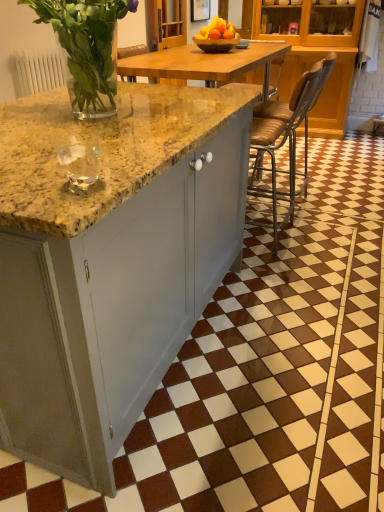
Find the location of a particular element. The width and height of the screenshot is (384, 512). clear glass vase at upper left is located at coordinates (87, 48).

At what (x,y) coordinates should I click in order to perform the action: click on matte gray cabinet at center. Please return your answer as a coordinate pair (x, y). The image size is (384, 512). Looking at the image, I should click on (109, 264).

This screenshot has width=384, height=512. Find the location of `metallic brown bar stool at center`. metallic brown bar stool at center is located at coordinates (286, 133).

The width and height of the screenshot is (384, 512). Describe the element at coordinates (79, 161) in the screenshot. I see `clear glass at left` at that location.

Looking at this image, what is the approximate height of wooden bowl at center?

2.49 inches.

Find the location of `clear glass vase at upper left`. clear glass vase at upper left is located at coordinates (87, 48).

From a real-world perspective, who is located higher, matte gray cabinet at center or wooden bowl at center?

wooden bowl at center, from a real-world perspective.

Would you say matte gray cabinet at center is inside or outside wooden bowl at center?

matte gray cabinet at center is spatially situated outside wooden bowl at center.

Does matte gray cabinet at center come behind wooden bowl at center?

No, the depth of matte gray cabinet at center is less than that of wooden bowl at center.

Can you confirm if matte gray cabinet at center is wider than wooden bowl at center?

Yes, matte gray cabinet at center is wider than wooden bowl at center.

Does wooden bowl at center touch clear glass vase at upper left?

There is a gap between wooden bowl at center and clear glass vase at upper left.

Considering the sizes of objects wooden bowl at center and clear glass vase at upper left in the image provided, who is thinner, wooden bowl at center or clear glass vase at upper left?

wooden bowl at center is thinner.

Can we say wooden bowl at center lies outside clear glass vase at upper left?

wooden bowl at center lies outside clear glass vase at upper left's area.

Between wooden bowl at center and clear glass vase at upper left, which one has smaller size?

wooden bowl at center.

Is clear glass vase at upper left thinner than wooden bowl at center?

No, clear glass vase at upper left is not thinner than wooden bowl at center.

From a real-world perspective, is clear glass vase at upper left physically located above or below wooden bowl at center?

Clearly, from a real-world perspective, clear glass vase at upper left is above wooden bowl at center.

Consider the image. Is clear glass vase at upper left positioned beyond the bounds of wooden bowl at center?

clear glass vase at upper left is positioned outside wooden bowl at center.

Which is closer to the camera, (111, 27) or (205, 42)?

Point (111, 27).

Is matte gray cabinet at center beside clear glass at left?

No.

Is matte gray cabinet at center positioned behind clear glass at left?

Yes, matte gray cabinet at center is further from the viewer.

Based on the photo, considering the relative sizes of matte gray cabinet at center and clear glass at left in the image provided, is matte gray cabinet at center shorter than clear glass at left?

Yes.

Can you confirm if clear glass at left is taller than metallic brown bar stool at center?

In fact, clear glass at left may be shorter than metallic brown bar stool at center.

From the image's perspective, is clear glass at left located above metallic brown bar stool at center?

No, from the image's perspective, clear glass at left is not above metallic brown bar stool at center.

Locate an element on the screen. The image size is (384, 512). wine glass in front of the metallic brown bar stool at center is located at coordinates (79, 161).

Which of these two, clear glass at left or metallic brown bar stool at center, is thinner?

Thinner between the two is clear glass at left.

From the image's perspective, is wooden bowl at center beneath clear glass at left?

Incorrect, from the image's perspective, wooden bowl at center is higher than clear glass at left.

Is the depth of wooden bowl at center less than that of clear glass at left?

No.

Which object is wider, wooden bowl at center or clear glass at left?

wooden bowl at center is wider.

From a real-world perspective, between wooden bowl at center and clear glass at left, who is vertically higher?

wooden bowl at center is physically above.

Considering the positions of objects clear glass vase at upper left and matte gray cabinet at center in the image provided, who is more to the right, clear glass vase at upper left or matte gray cabinet at center?

Positioned to the right is matte gray cabinet at center.

Can you tell me how much clear glass vase at upper left and matte gray cabinet at center differ in facing direction?

87.7 degrees.

Considering the positions of objects clear glass vase at upper left and matte gray cabinet at center in the image provided, who is behind, clear glass vase at upper left or matte gray cabinet at center?

clear glass vase at upper left is further away from the camera.

Measure the distance between clear glass vase at upper left and matte gray cabinet at center.

20.51 inches.

At what (x,y) coordinates should I click in order to perform the action: click on bowl behind the matte gray cabinet at center. Please return your answer as a coordinate pair (x, y). The image size is (384, 512). Looking at the image, I should click on (216, 44).

Where is `bowl to the right of clear glass vase at upper left`? bowl to the right of clear glass vase at upper left is located at coordinates click(216, 44).

Estimate the real-world distances between objects in this image. Which object is closer to matte gray cabinet at center, clear glass at left or wooden bowl at center?

The object closer to matte gray cabinet at center is clear glass at left.

Estimate the real-world distances between objects in this image. Which object is closer to clear glass vase at upper left, wooden bowl at center or clear glass at left?

Based on the image, clear glass at left appears to be nearer to clear glass vase at upper left.

Which object lies further to the anchor point matte gray cabinet at center, clear glass at left or metallic brown bar stool at center?

metallic brown bar stool at center lies further to matte gray cabinet at center than the other object.

Estimate the real-world distances between objects in this image. Which object is further from clear glass at left, matte gray cabinet at center or metallic brown bar stool at center?

The object further to clear glass at left is metallic brown bar stool at center.

Looking at this image, when comparing their distances from metallic brown bar stool at center, does matte gray cabinet at center or clear glass at left seem further?

Based on the image, clear glass at left appears to be further to metallic brown bar stool at center.

Considering their positions, is matte gray cabinet at center positioned further to clear glass at left than wooden bowl at center?

Based on the image, wooden bowl at center appears to be further to clear glass at left.

From the image, which object appears to be nearer to clear glass at left, metallic brown bar stool at center or clear glass vase at upper left?

clear glass vase at upper left lies closer to clear glass at left than the other object.

Considering their positions, is matte gray cabinet at center positioned further to metallic brown bar stool at center than wooden bowl at center?

matte gray cabinet at center is further to metallic brown bar stool at center.

Where is `floral arrangement between matte gray cabinet at center and metallic brown bar stool at center along the z-axis`? The width and height of the screenshot is (384, 512). floral arrangement between matte gray cabinet at center and metallic brown bar stool at center along the z-axis is located at coordinates (87, 48).

Identify the location of chair positioned between clear glass vase at upper left and wooden bowl at center from near to far. This screenshot has height=512, width=384. (286, 133).

The image size is (384, 512). Identify the location of cabinetry located between clear glass at left and metallic brown bar stool at center in the depth direction. (109, 264).

Where is `floral arrangement between clear glass at left and wooden bowl at center along the z-axis`? floral arrangement between clear glass at left and wooden bowl at center along the z-axis is located at coordinates click(x=87, y=48).